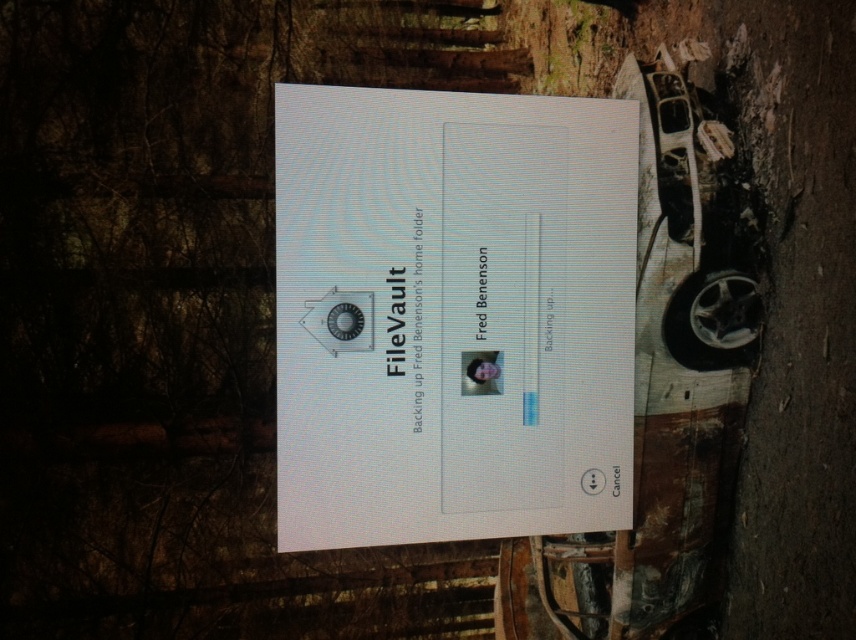
Does white glossy paper at center appear over silver metallic car at right?

No.

Which is below, white glossy paper at center or silver metallic car at right?

white glossy paper at center

Describe the element at coordinates (452, 314) in the screenshot. Image resolution: width=856 pixels, height=640 pixels. I see `white glossy paper at center` at that location.

In order to click on white glossy paper at center in this screenshot , I will do `click(452, 314)`.